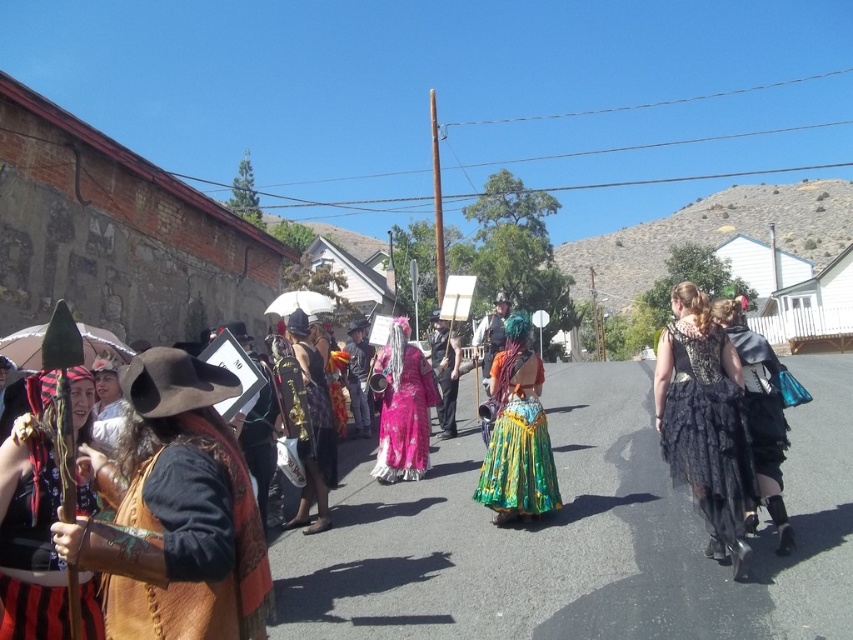
You are a photographer trying to capture both the velvet black dress at center and the shiny gold dress at center in a single frame. Given that your camera has a limited focus range, which dress should you prioritize focusing on to ensure it appears sharp, considering their sizes?

The velvet black dress at center is thinner than the shiny gold dress at center, so you should prioritize focusing on the shiny gold dress at center since it is larger and may require more precise focus to capture details.

You are a photographer trying to capture a candid shot of the two central figures in the velvet black dress at center and the multicolored fabric skirt at center. Since you want to ensure both are fully visible in your frame, which of the two should you focus on first to avoid cropping either?

The velvet black dress at center is thinner than the multicolored fabric skirt at center, so you should focus on the multicolored fabric skirt at center first to ensure it fits entirely within the frame.